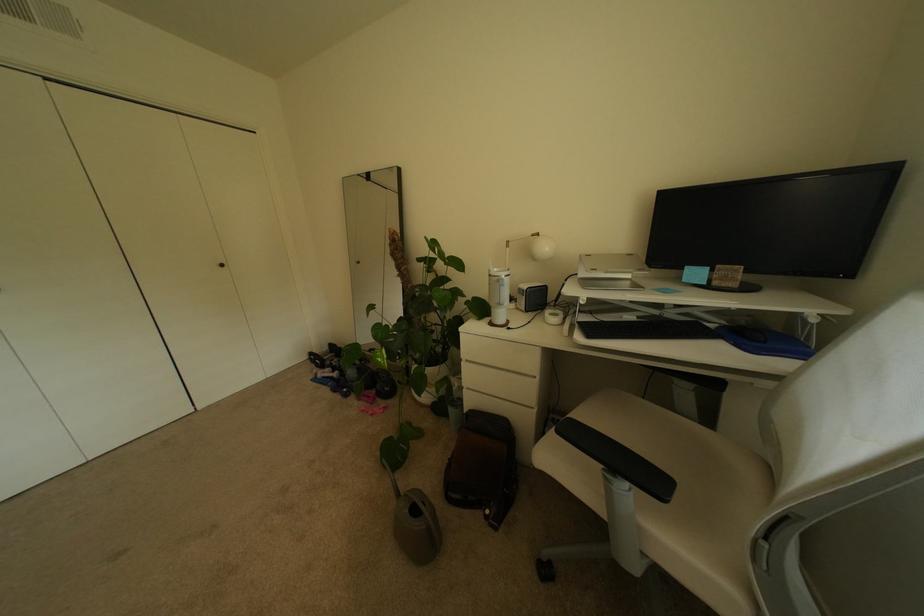
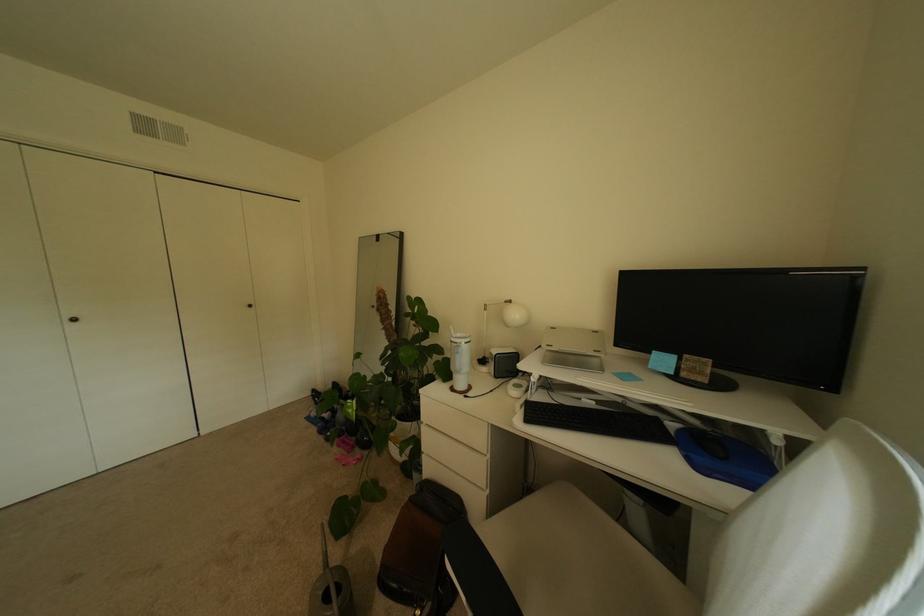
Question: The images are taken continuously from a first-person perspective. In which direction is your viewpoint rotating?

Choices:
 (A) Left
 (B) Right
 (C) Up
 (D) Down

Answer: (C)